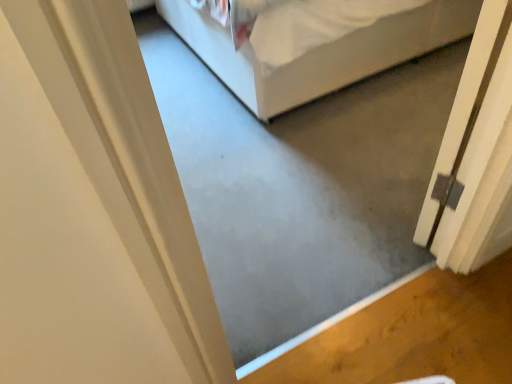
In order to face white matte door at right, should I rotate leftwards or rightwards?

A 28.134 degree turn to the right will do.

Locate an element on the screen. This screenshot has width=512, height=384. white matte door at right is located at coordinates (475, 154).

Describe the element at coordinates (475, 154) in the screenshot. I see `white matte door at right` at that location.

Describe the element at coordinates (315, 43) in the screenshot. The height and width of the screenshot is (384, 512). I see `white fabric bed at center` at that location.

At what (x,y) coordinates should I click in order to perform the action: click on white fabric bed at center. Please return your answer as a coordinate pair (x, y). Looking at the image, I should click on [x=315, y=43].

This screenshot has width=512, height=384. What are the coordinates of `white matte door at right` in the screenshot? It's located at (475, 154).

Would you say white matte door at right is to the left or to the right of white fabric bed at center in the picture?

white matte door at right is positioned on white fabric bed at center's right side.

Considering the positions of objects white matte door at right and white fabric bed at center in the image provided, who is in front, white matte door at right or white fabric bed at center?

white matte door at right is closer to the camera.

Considering the positions of point (495, 58) and point (440, 22), is point (495, 58) closer or farther from the camera than point (440, 22)?

Point (495, 58).

From the image's perspective, is white matte door at right above white fabric bed at center?

Actually, white matte door at right appears below white fabric bed at center in the image.

From a real-world perspective, which object rests below the other?

From a 3D spatial view, white fabric bed at center is below.

Does white matte door at right have a greater width compared to white fabric bed at center?

Incorrect, the width of white matte door at right does not surpass that of white fabric bed at center.

Is white matte door at right taller than white fabric bed at center?

Correct, white matte door at right is much taller as white fabric bed at center.

Which of these two, white matte door at right or white fabric bed at center, is bigger?

white fabric bed at center is bigger.

Based on the photo, is white fabric bed at center inside white matte door at right?

No, white matte door at right does not contain white fabric bed at center.

Is white matte door at right far away from white fabric bed at center?

white matte door at right is near white fabric bed at center, not far away.

Is white matte door at right looking in the opposite direction of white fabric bed at center?

No.

Measure the distance from white matte door at right to white fabric bed at center.

The distance of white matte door at right from white fabric bed at center is 38.03 inches.

You are a GUI agent. You are given a task and a screenshot of the screen. Output one action in this format:
    pyautogui.click(x=<x>, y=<y>)
    Task: Click on the door in front of the white fabric bed at center
    Image resolution: width=512 pixels, height=384 pixels.
    Given the screenshot: What is the action you would take?
    pyautogui.click(x=475, y=154)

Is white fabric bed at center to the right of white matte door at right from the viewer's perspective?

In fact, white fabric bed at center is to the left of white matte door at right.

Considering their positions, is white fabric bed at center located in front of or behind white matte door at right?

Visually, white fabric bed at center is located behind white matte door at right.

Does point (375, 61) come farther from viewer compared to point (498, 208)?

Yes, it is.

From the image's perspective, is white fabric bed at center located above or below white matte door at right?

white fabric bed at center is above white matte door at right.

From a real-world perspective, is white fabric bed at center under white matte door at right?

Yes, from a real-world perspective, white fabric bed at center is under white matte door at right.

In the scene shown: Which object is thinner, white fabric bed at center or white matte door at right?

Thinner between the two is white matte door at right.

Who is shorter, white fabric bed at center or white matte door at right?

white fabric bed at center is shorter.

Between white fabric bed at center and white matte door at right, which one has larger size?

white fabric bed at center is bigger.

Choose the correct answer: Is white fabric bed at center inside white matte door at right or outside it?

white fabric bed at center is not enclosed by white matte door at right.

Are white fabric bed at center and white matte door at right making contact?

No, white fabric bed at center is not with white matte door at right.

Could you tell me if white fabric bed at center is turned towards white matte door at right?

No.

Identify the location of door that is below the white fabric bed at center (from the image's perspective). (475, 154).

Image resolution: width=512 pixels, height=384 pixels. I want to click on door above the white fabric bed at center (from a real-world perspective), so click(475, 154).

At what (x,y) coordinates should I click in order to perform the action: click on bed behind the white matte door at right. Please return your answer as a coordinate pair (x, y). Looking at the image, I should click on (315, 43).